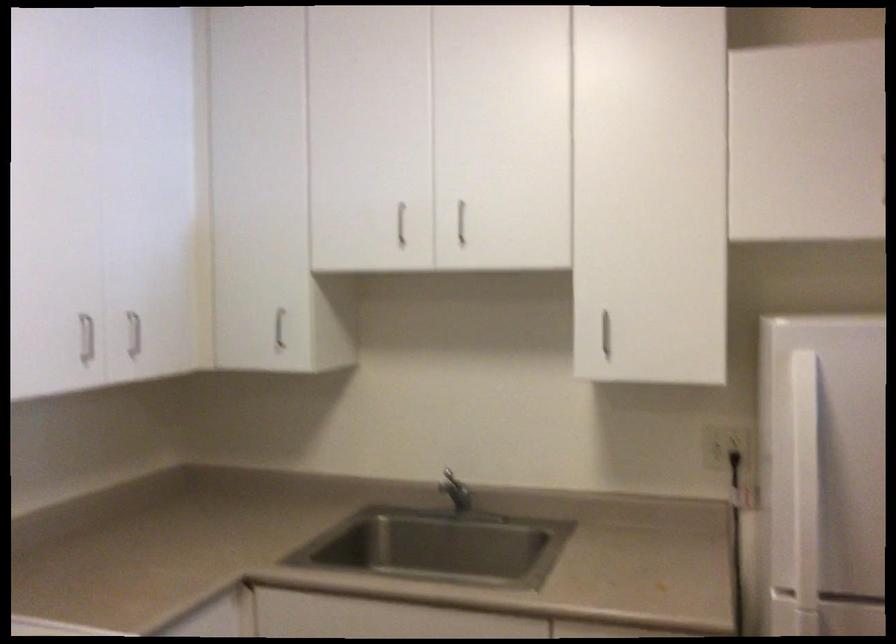
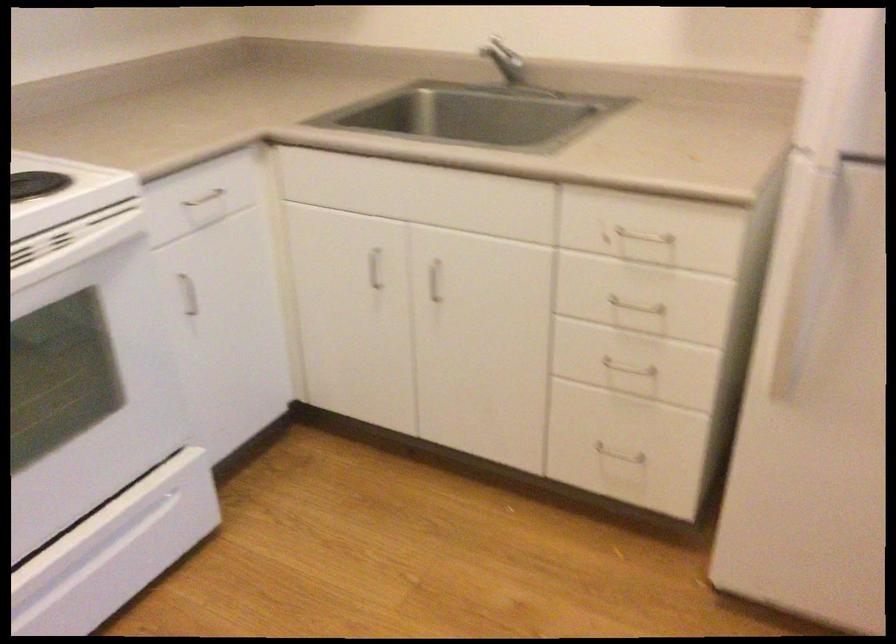
Question: The first image is from the beginning of the video and the second image is from the end. How did the camera likely rotate when shooting the video?

Choices:
 (A) Left
 (B) Right
 (C) Up
 (D) Down

Answer: (D)